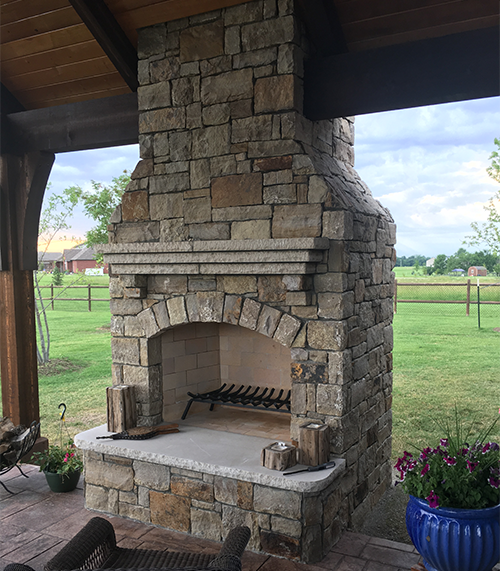
Where is `brick fireplace`? brick fireplace is located at coordinates (249, 327).